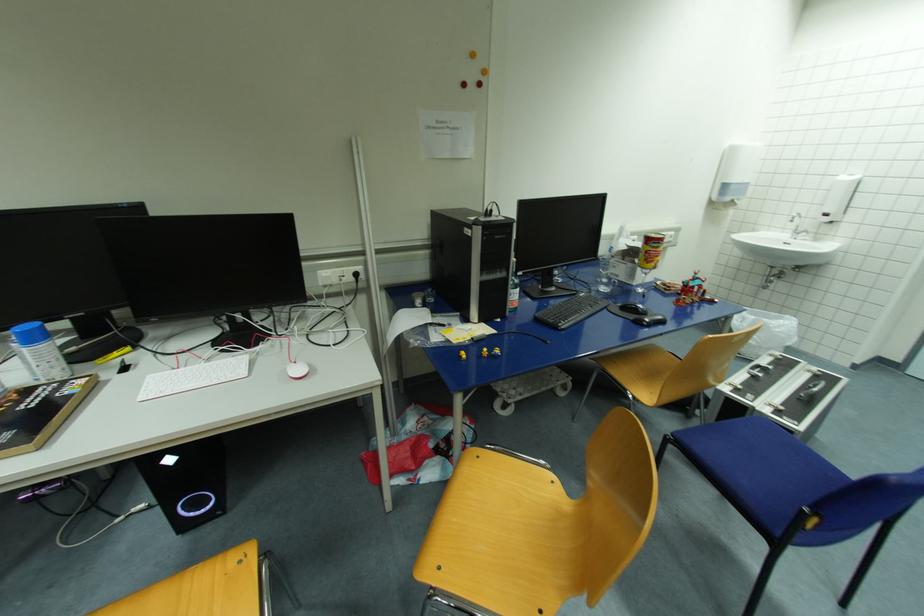
Locate an element on the screen. The image size is (924, 616). illuminated PC button is located at coordinates (195, 504).